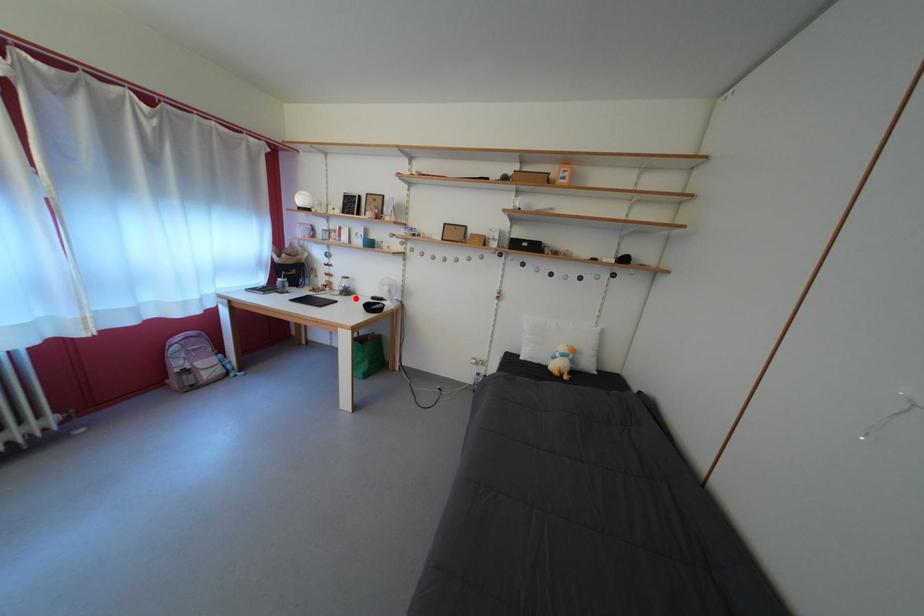
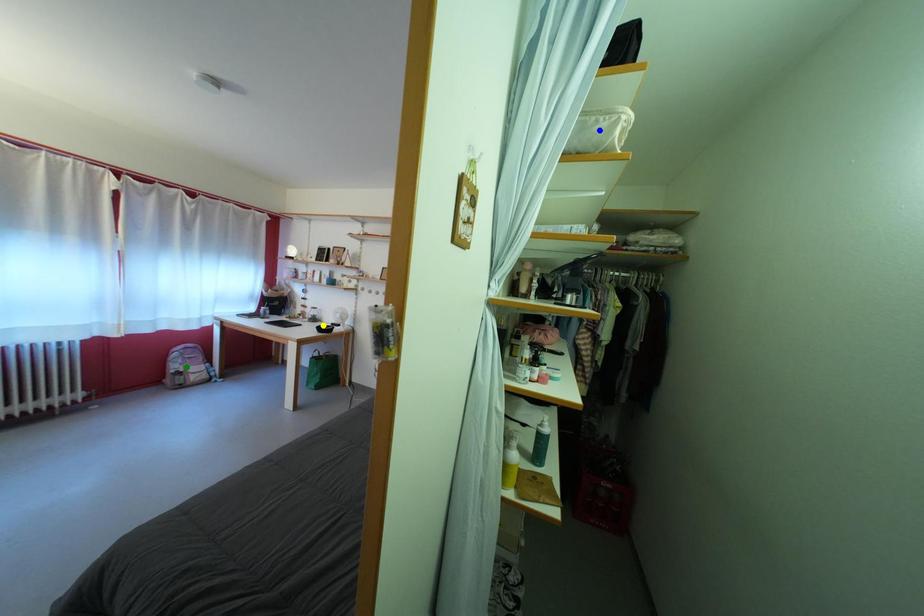
Question: I am providing you with two images of the same scene from different viewpoints. A red point is marked on the first image. You are given multiple points on the second image. Which spot in image 2 lines up with the point in image 1?

Choices:
 (A) green point
 (B) yellow point
 (C) blue point

Answer: (B)